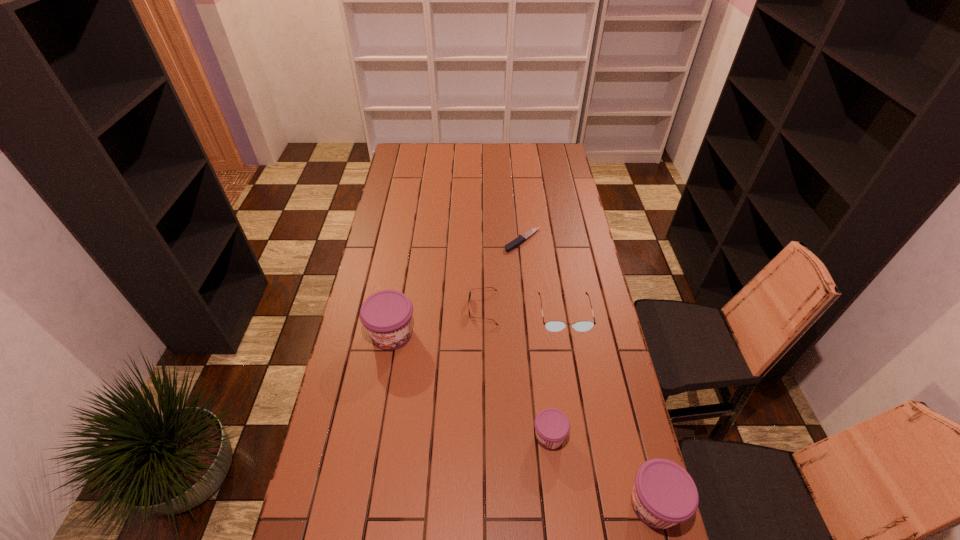
Locate an element on the screen. The width and height of the screenshot is (960, 540). free spot between the leftmost jam and the third shortest object is located at coordinates (478, 323).

You are a GUI agent. You are given a task and a screenshot of the screen. Output one action in this format:
    pyautogui.click(x=<x>, y=<y>)
    Task: Click on the free spot between the farthest object and the farthest jam
    
    Given the screenshot: What is the action you would take?
    pyautogui.click(x=457, y=287)

I want to click on free area in between the farthest jam and the steak knife, so click(x=457, y=287).

Find the location of a particular element. object that is the third closest to the shortest jam is located at coordinates (486, 287).

Identify which object is located as the third nearest to the sunglasses. Please provide its 2D coordinates. Your answer should be formatted as a tuple, i.e. [(x, y)], where the tuple contains the x and y coordinates of a point satisfying the conditions above.

[(519, 240)]

Find the location of a particular element. This screenshot has width=960, height=540. the second closest jam to the fourth shortest object is located at coordinates (387, 315).

The width and height of the screenshot is (960, 540). In order to click on jam that stands as the second closest to the second tallest jam in this screenshot , I will do `click(387, 315)`.

Where is `free space that satisfies the following two spatial constraints: 1. on the lenses of the fifth tallest object; 2. on the front label of the leftmost object`? This screenshot has height=540, width=960. free space that satisfies the following two spatial constraints: 1. on the lenses of the fifth tallest object; 2. on the front label of the leftmost object is located at coordinates (483, 334).